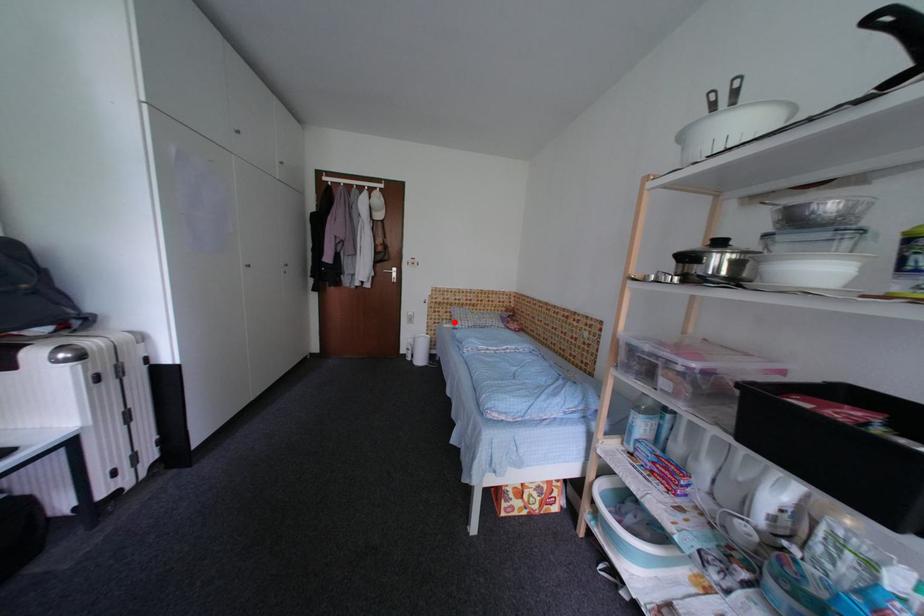
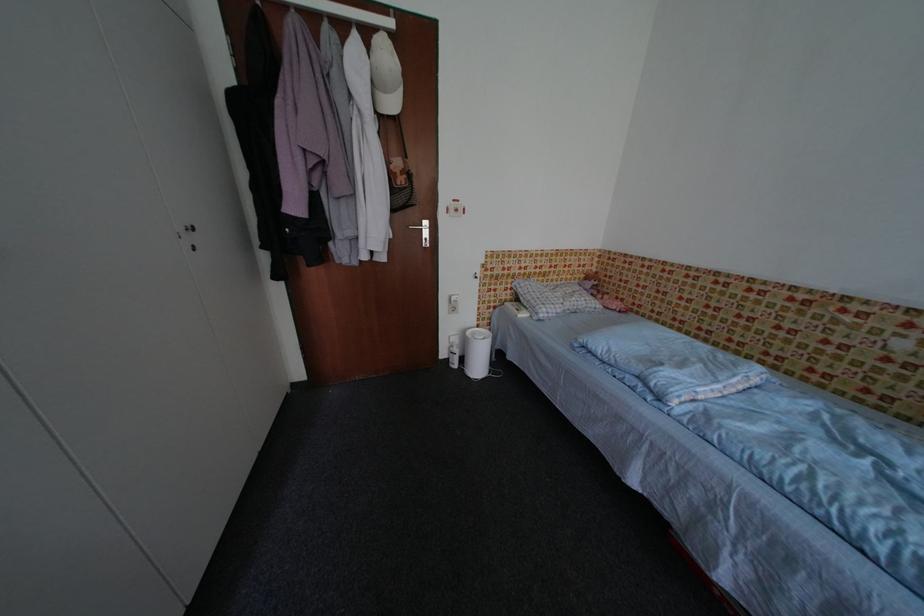
Question: I am providing you with two images of the same scene from different viewpoints. A red point is marked on the first image. At the location where the point appears in image 1, is it still visible in image 2?

Choices:
 (A) Yes
 (B) No

Answer: (A)